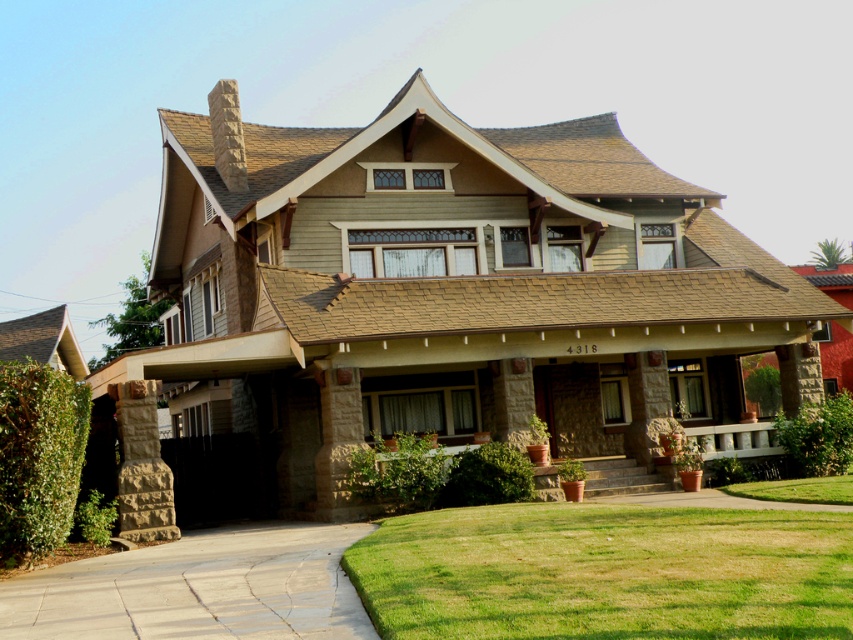
Based on the photo, is green grass at lower center in front of smooth concrete driveway at lower left?

That is True.

Is green grass at lower center taller than smooth concrete driveway at lower left?

In fact, green grass at lower center may be shorter than smooth concrete driveway at lower left.

From the picture: Measure the distance between green grass at lower center and camera.

green grass at lower center is 6.67 meters away from camera.

At what (x,y) coordinates should I click in order to perform the action: click on green grass at lower center. Please return your answer as a coordinate pair (x, y). This screenshot has width=853, height=640. Looking at the image, I should click on (606, 572).